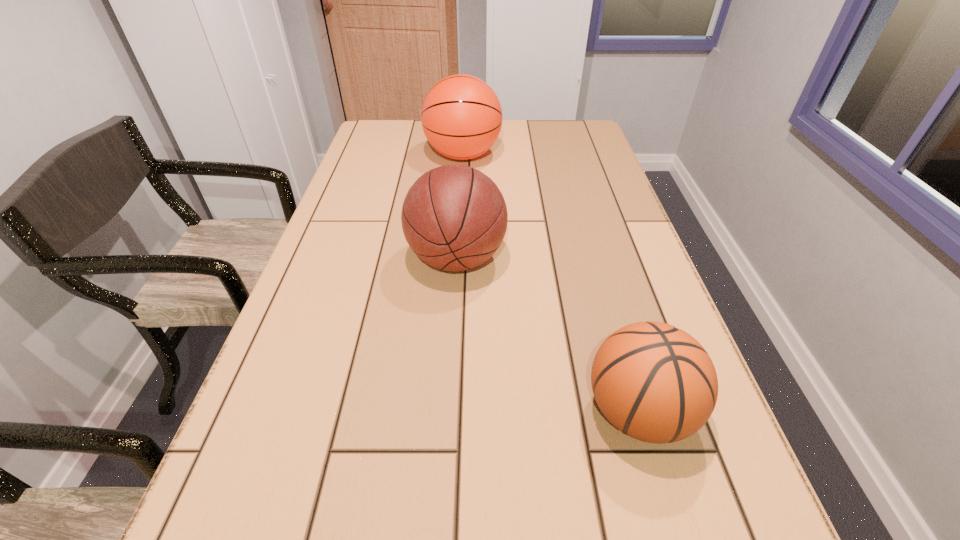
Find the location of a particular element. This screenshot has width=960, height=540. the farthest object is located at coordinates (461, 116).

Locate an element on the screen. The height and width of the screenshot is (540, 960). the second farthest object is located at coordinates (454, 217).

Find the location of a particular element. This screenshot has height=540, width=960. the nearest object is located at coordinates (656, 383).

This screenshot has width=960, height=540. Find the location of `the rightmost basketball`. the rightmost basketball is located at coordinates click(x=656, y=383).

The image size is (960, 540). In order to click on vacant space located on the right of the farthest basketball in this screenshot , I will do `click(563, 156)`.

In order to click on vacant space located 0.390m on the back of the second farthest basketball in this screenshot , I will do `click(463, 154)`.

I want to click on vacant area situated on the left of the rightmost object, so click(x=384, y=411).

At what (x,y) coordinates should I click in order to perform the action: click on object present at the far edge. Please return your answer as a coordinate pair (x, y). Looking at the image, I should click on (461, 116).

This screenshot has height=540, width=960. What are the coordinates of `object that is positioned at the right edge` in the screenshot? It's located at (656, 383).

Locate an element on the screen. The width and height of the screenshot is (960, 540). free space at the far edge of the desktop is located at coordinates (508, 135).